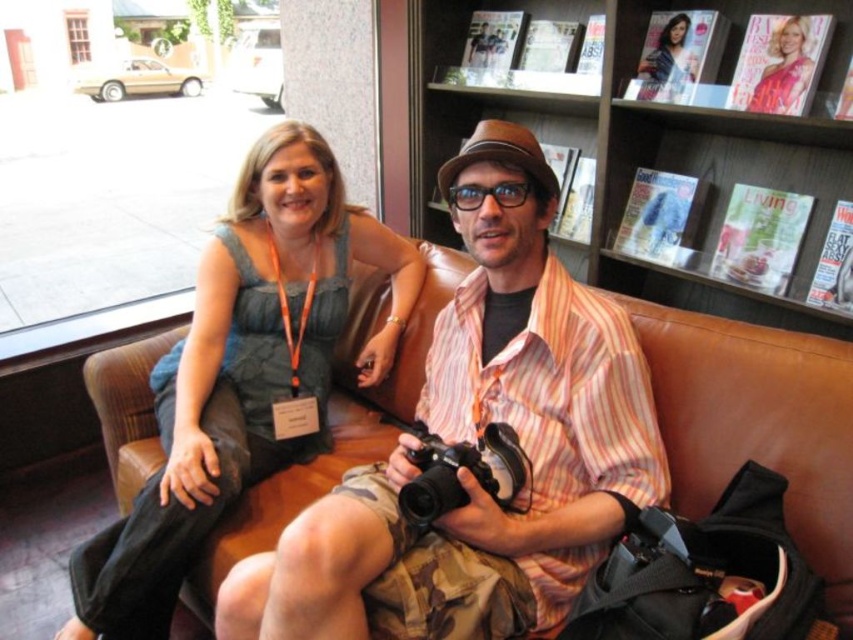
Is brown leather couch at center to the left of wooden bookshelf at upper right from the viewer's perspective?

Correct, you'll find brown leather couch at center to the left of wooden bookshelf at upper right.

Which of these two, brown leather couch at center or wooden bookshelf at upper right, stands shorter?

brown leather couch at center is shorter.

The image size is (853, 640). Describe the element at coordinates (757, 422) in the screenshot. I see `brown leather couch at center` at that location.

This screenshot has height=640, width=853. Find the location of `brown leather couch at center`. brown leather couch at center is located at coordinates (757, 422).

Locate an element on the screen. The height and width of the screenshot is (640, 853). wooden bookshelf at upper right is located at coordinates (625, 141).

Who is shorter, wooden bookshelf at upper right or blonde hair at upper right?

blonde hair at upper right

Find the location of a particular element. wooden bookshelf at upper right is located at coordinates (625, 141).

Which is in front, point (119, 556) or point (585, 102)?

Point (119, 556) is more forward.

Does matte green dress at center have a greater height compared to wooden bookshelf at upper right?

Yes, matte green dress at center is taller than wooden bookshelf at upper right.

Who is more distant from viewer, [253,269] or [729,17]?

Positioned behind is point [729,17].

This screenshot has width=853, height=640. Find the location of `matte green dress at center`. matte green dress at center is located at coordinates (242, 372).